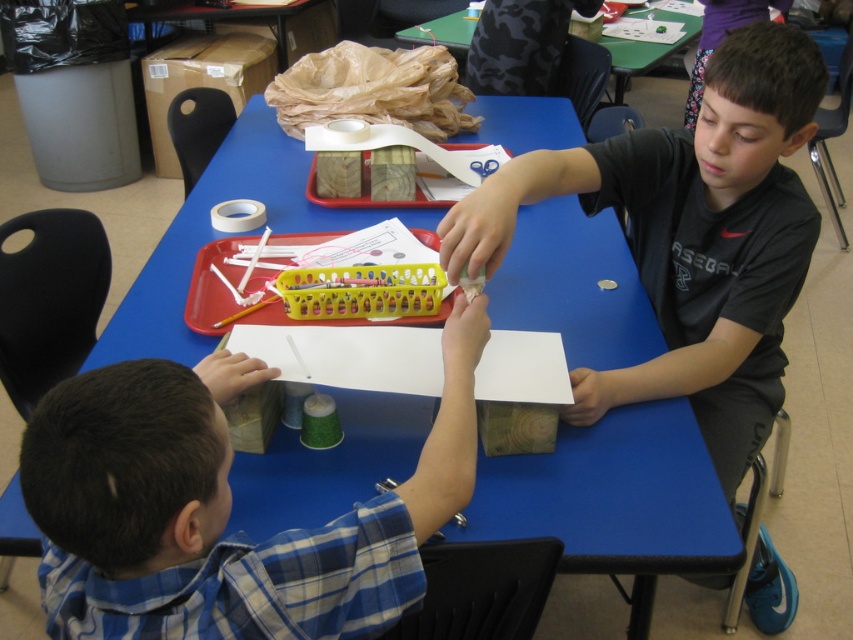
Is blue wood table at center bigger than brown paper bag at upper center?

Yes, blue wood table at center is bigger than brown paper bag at upper center.

Which is below, blue wood table at center or brown paper bag at upper center?

blue wood table at center

Find the location of a particular element. The height and width of the screenshot is (640, 853). blue wood table at center is located at coordinates (614, 499).

The image size is (853, 640). Describe the element at coordinates (614, 499) in the screenshot. I see `blue wood table at center` at that location.

Is blue wood table at center further to the viewer compared to green plastic table at upper center?

No, it is not.

Does point (534, 120) come behind point (624, 86)?

No, (534, 120) is in front of (624, 86).

The height and width of the screenshot is (640, 853). In order to click on blue wood table at center in this screenshot , I will do `click(614, 499)`.

Can you confirm if brown paper bag at upper center is bigger than green plastic table at upper center?

No.

Does brown paper bag at upper center appear on the right side of green plastic table at upper center?

No, brown paper bag at upper center is not to the right of green plastic table at upper center.

The image size is (853, 640). Find the location of `brown paper bag at upper center`. brown paper bag at upper center is located at coordinates (373, 90).